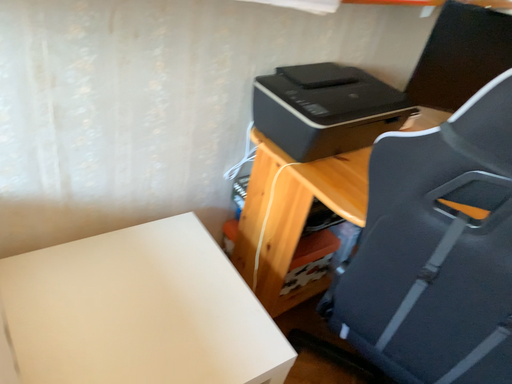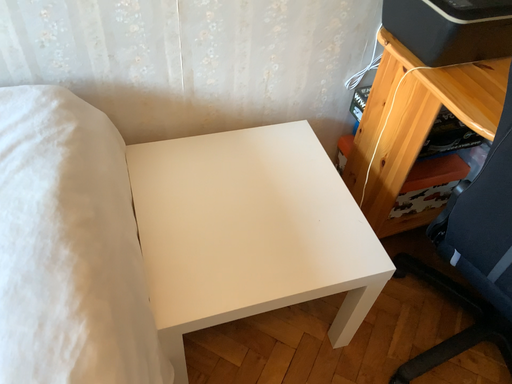
Question: Which way did the camera rotate in the video?

Choices:
 (A) rotated upward
 (B) rotated downward

Answer: (B)